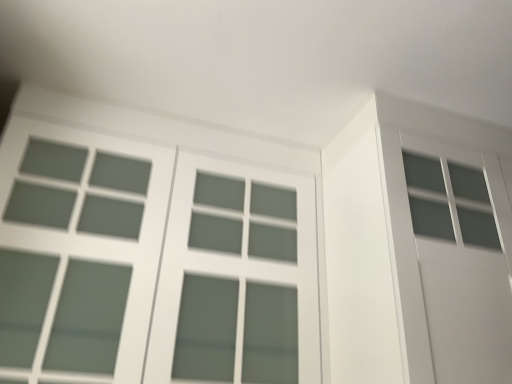
Question: In terms of size, does satin white screen door at upper right appear bigger or smaller than satin white window at upper left?

Choices:
 (A) small
 (B) big

Answer: (A)

Question: Do you think satin white screen door at upper right is within satin white window at upper left, or outside of it?

Choices:
 (A) outside
 (B) inside

Answer: (A)

Question: From the image's perspective, is satin white screen door at upper right positioned above or below satin white window at upper left?

Choices:
 (A) above
 (B) below

Answer: (B)

Question: Is satin white window at upper left inside the boundaries of satin white screen door at upper right, or outside?

Choices:
 (A) inside
 (B) outside

Answer: (B)

Question: Is satin white window at upper left wider or thinner than satin white screen door at upper right?

Choices:
 (A) thin
 (B) wide

Answer: (B)

Question: Is satin white window at upper left to the left or to the right of satin white screen door at upper right in the image?

Choices:
 (A) right
 (B) left

Answer: (B)

Question: Does point (10, 226) appear closer or farther from the camera than point (495, 238)?

Choices:
 (A) closer
 (B) farther

Answer: (A)